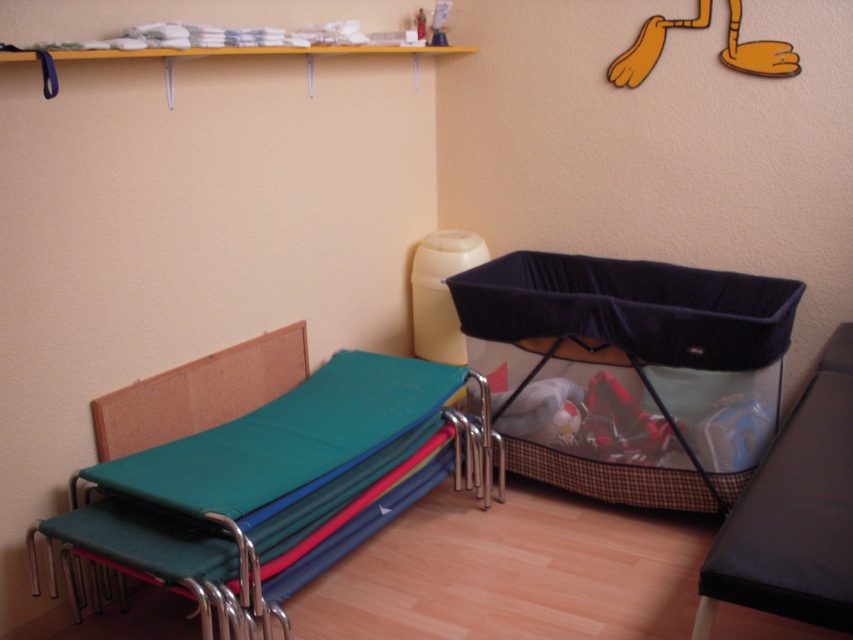
Question: Based on their relative distances, which object is nearer to the velvet black crib at center?

Choices:
 (A) teal fabric chair at lower left
 (B) wooden shelf at upper center
 (C) black fabric chair at lower right

Answer: (C)

Question: Which is nearer to the teal fabric chair at lower left?

Choices:
 (A) black fabric chair at lower right
 (B) wooden shelf at upper center

Answer: (A)

Question: Does teal fabric chair at lower left lie behind wooden shelf at upper center?

Choices:
 (A) no
 (B) yes

Answer: (B)

Question: Is the position of velvet black crib at center more distant than that of teal fabric chair at lower left?

Choices:
 (A) no
 (B) yes

Answer: (B)

Question: Where is velvet black crib at center located in relation to black fabric chair at lower right in the image?

Choices:
 (A) left
 (B) right

Answer: (A)

Question: Estimate the real-world distances between objects in this image. Which object is farther from the black fabric chair at lower right?

Choices:
 (A) wooden shelf at upper center
 (B) velvet black crib at center
 (C) teal fabric chair at lower left

Answer: (A)